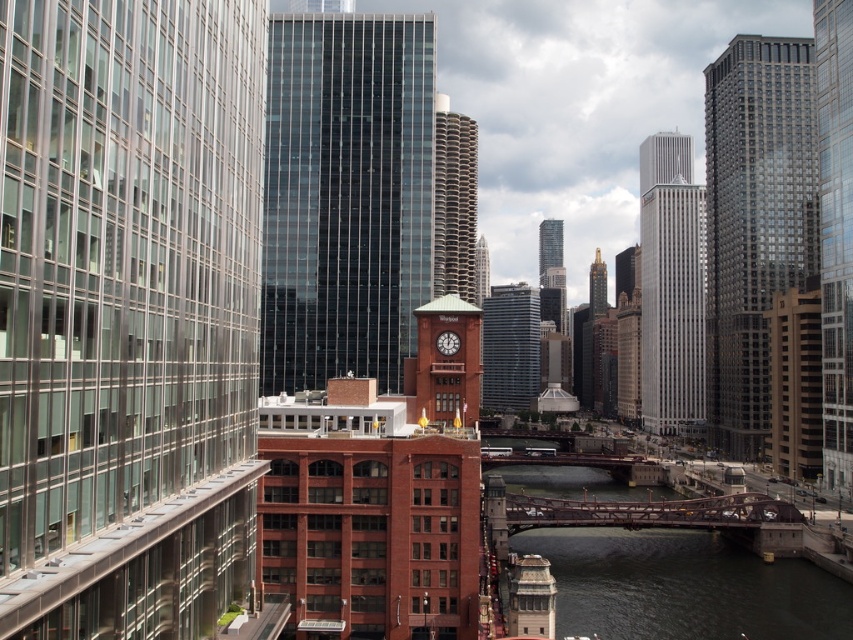
Is glassy steel skyscraper at center further to the viewer compared to brown textured building at center?

That is False.

Is point (366, 93) farther from viewer compared to point (440, 282)?

No.

Does point (338, 218) come farther from viewer compared to point (457, 225)?

No, (338, 218) is in front of (457, 225).

Locate an element on the screen. glassy steel skyscraper at center is located at coordinates (345, 196).

Find the location of a particular element. Image resolution: width=853 pixels, height=640 pixels. silver glass skyscraper at center is located at coordinates (671, 289).

Does silver glass skyscraper at center have a greater width compared to brown textured building at center?

Yes.

Between point (677, 408) and point (434, 131), which one is positioned behind?

The point (677, 408) is behind.

Where is `silver glass skyscraper at center`? Image resolution: width=853 pixels, height=640 pixels. silver glass skyscraper at center is located at coordinates pyautogui.click(x=671, y=289).

Can you confirm if silver glass skyscraper at center is positioned above glassy reflective skyscraper at center?

No, silver glass skyscraper at center is not above glassy reflective skyscraper at center.

Does silver glass skyscraper at center have a smaller size compared to glassy reflective skyscraper at center?

Actually, silver glass skyscraper at center might be larger than glassy reflective skyscraper at center.

This screenshot has width=853, height=640. Find the location of `silver glass skyscraper at center`. silver glass skyscraper at center is located at coordinates (671, 289).